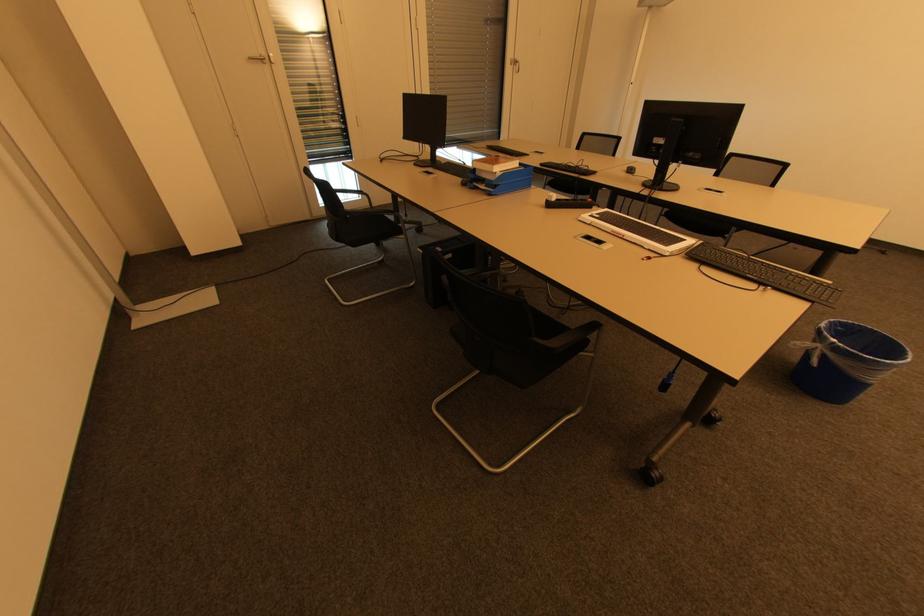
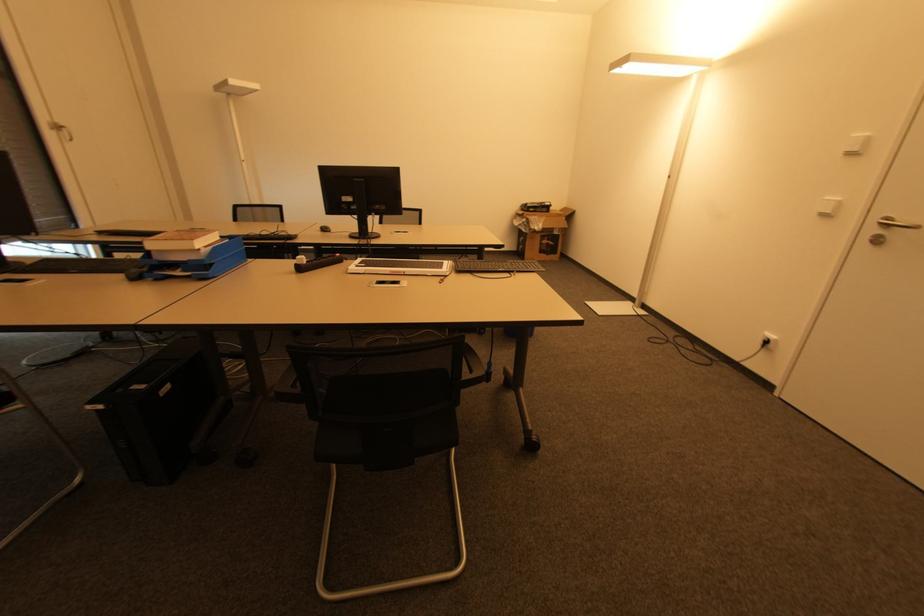
Find the pixel in the second image that matches [591,216] in the first image.

(359, 267)